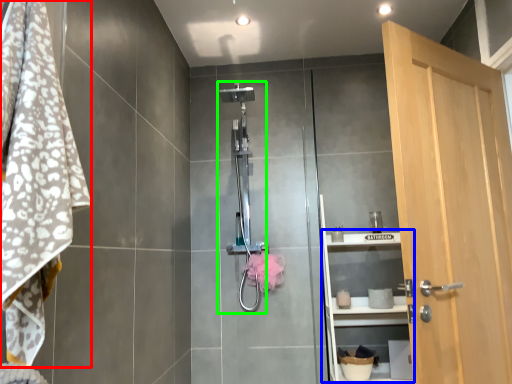
Question: Considering the real-world distances, which object is farthest from bath towel (highlighted by a red box)? shelf (highlighted by a blue box) or shower (highlighted by a green box)?

Choices:
 (A) shelf
 (B) shower

Answer: (A)